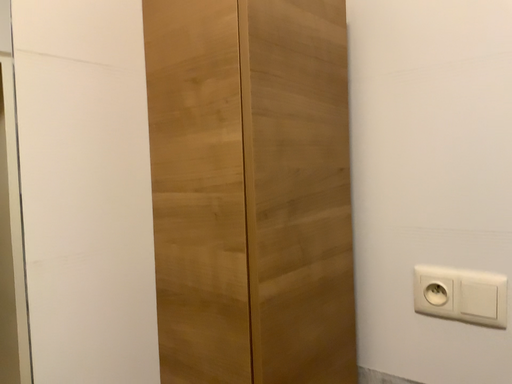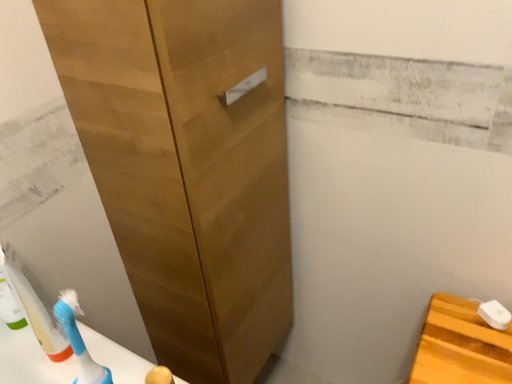
Question: How did the camera likely rotate when shooting the video?

Choices:
 (A) rotated downward
 (B) rotated upward

Answer: (A)